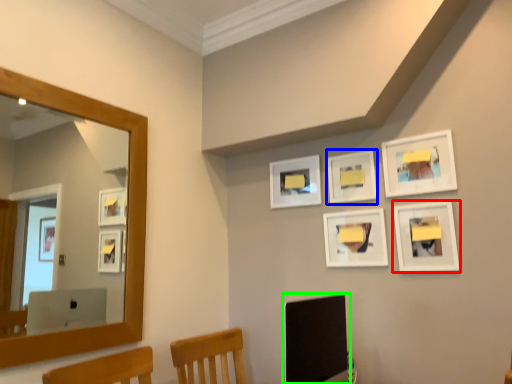
Question: Considering the real-world distances, which object is closest to picture frame (highlighted by a red box)? picture frame (highlighted by a blue box) or computer monitor (highlighted by a green box).

Choices:
 (A) picture frame
 (B) computer monitor

Answer: (A)